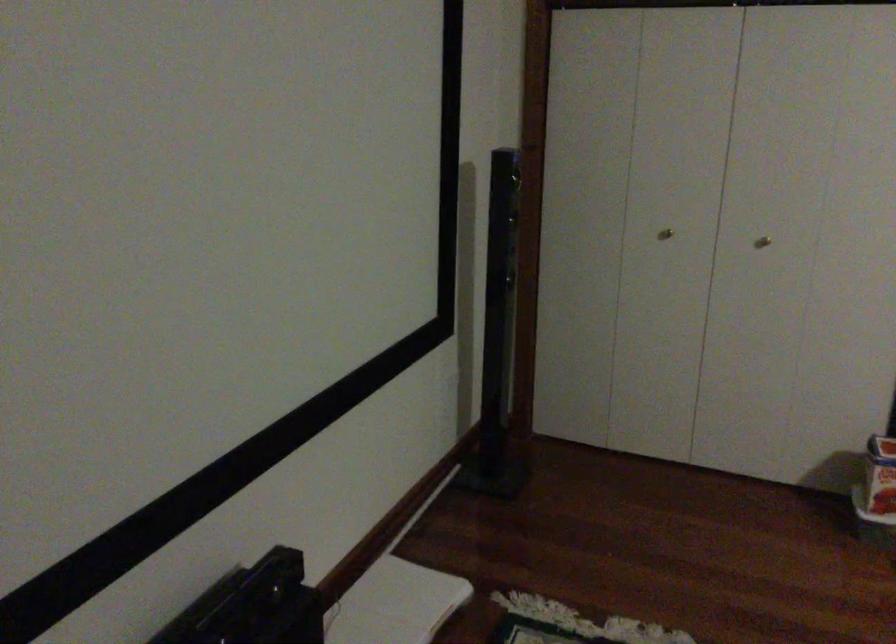
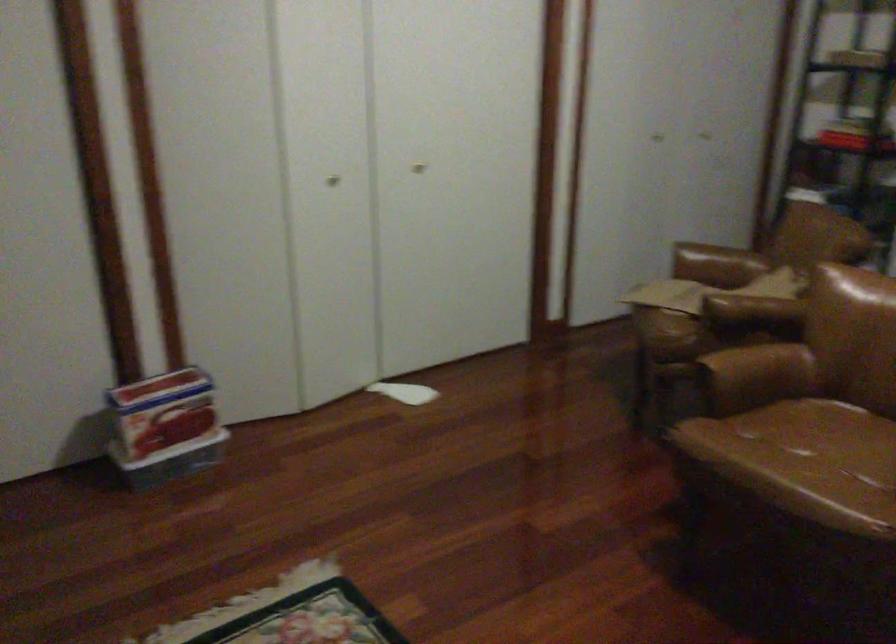
Question: How did the camera likely rotate?

Choices:
 (A) Left
 (B) Right
 (C) Up
 (D) Down

Answer: (B)